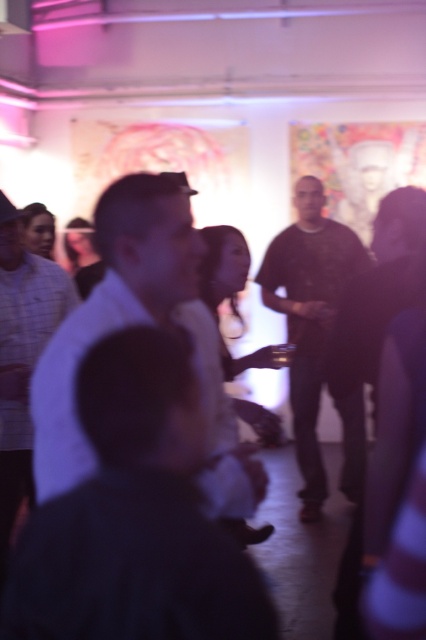
Question: Which point is farther to the camera?

Choices:
 (A) (20, 465)
 (B) (155, 520)
 (C) (210, 442)

Answer: (A)

Question: Which point appears closest to the camera in this image?

Choices:
 (A) (270, 253)
 (B) (8, 444)

Answer: (B)

Question: Is dark blue shirt at center positioned in front of white shirt at center?

Choices:
 (A) yes
 (B) no

Answer: (A)

Question: Which object is closer to the camera taking this photo?

Choices:
 (A) white matte shirt at center
 (B) dark gray shirt at center

Answer: (A)

Question: Is dark blue shirt at center bigger than white shirt at center?

Choices:
 (A) no
 (B) yes

Answer: (A)

Question: Can you confirm if white shirt at center is wider than white matte shirt at center?

Choices:
 (A) yes
 (B) no

Answer: (A)